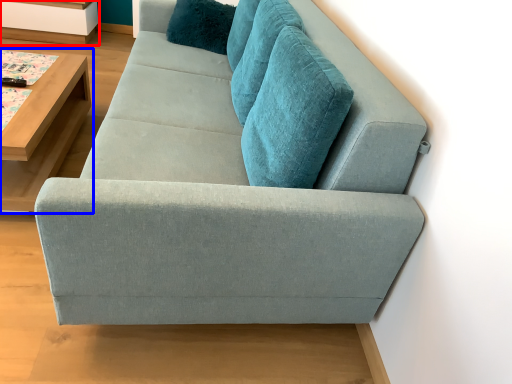
Question: Which of the following is the closest to the observer, shelf (highlighted by a red box) or table (highlighted by a blue box)?

Choices:
 (A) shelf
 (B) table

Answer: (B)